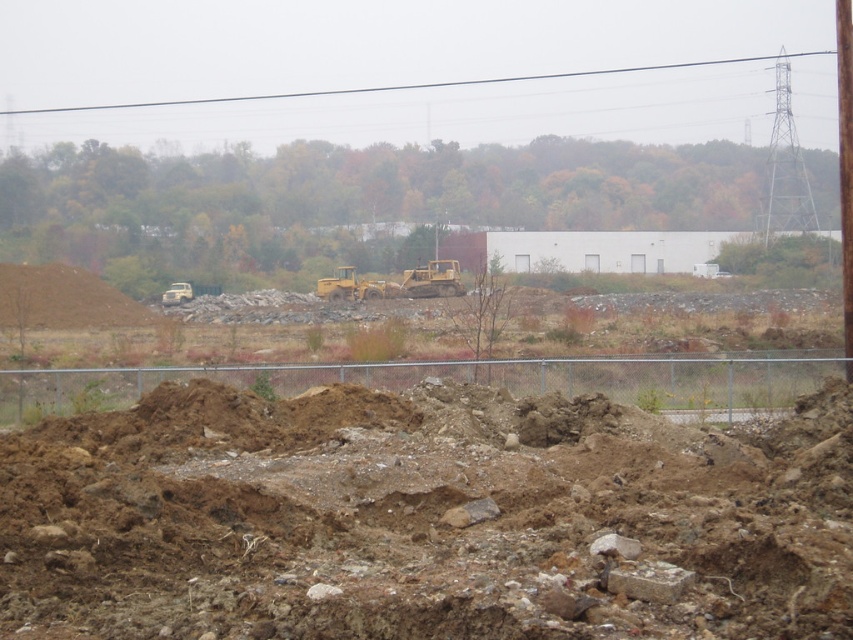
Question: Which object is farther from the camera taking this photo?

Choices:
 (A) black wire at upper center
 (B) yellow metallic excavator at center

Answer: (A)

Question: Which of the following is the closest to the observer?

Choices:
 (A) (779, 56)
 (B) (372, 291)

Answer: (B)

Question: Is black wire at upper center closer to the viewer compared to yellow metallic excavator at center?

Choices:
 (A) no
 (B) yes

Answer: (A)

Question: Which point appears farthest from the camera in this image?

Choices:
 (A) (450, 291)
 (B) (375, 88)

Answer: (B)

Question: Does black wire at upper center have a larger size compared to yellow metallic excavator at center?

Choices:
 (A) no
 (B) yes

Answer: (B)

Question: Can you confirm if black wire at upper center is positioned to the left of yellow metallic excavator at center?

Choices:
 (A) no
 (B) yes

Answer: (A)